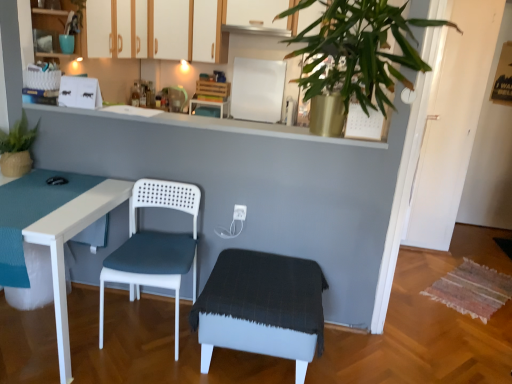
Question: Considering the relative positions of white plastic electric outlet at center and white fabric step stool at center in the image provided, is white plastic electric outlet at center to the right of white fabric step stool at center from the viewer's perspective?

Choices:
 (A) yes
 (B) no

Answer: (B)

Question: Is the position of white plastic electric outlet at center more distant than that of white fabric step stool at center?

Choices:
 (A) no
 (B) yes

Answer: (B)

Question: Is white plastic electric outlet at center at the left side of white fabric step stool at center?

Choices:
 (A) yes
 (B) no

Answer: (A)

Question: Does white plastic electric outlet at center have a lesser height compared to white fabric step stool at center?

Choices:
 (A) no
 (B) yes

Answer: (B)

Question: From the image's perspective, would you say white plastic electric outlet at center is positioned over white fabric step stool at center?

Choices:
 (A) yes
 (B) no

Answer: (A)

Question: Which is correct: white fabric step stool at center is inside teal glossy cup at upper left, or outside of it?

Choices:
 (A) inside
 (B) outside

Answer: (B)

Question: Considering the positions of point (283, 311) and point (70, 44), is point (283, 311) closer or farther from the camera than point (70, 44)?

Choices:
 (A) closer
 (B) farther

Answer: (A)

Question: In terms of size, does white fabric step stool at center appear bigger or smaller than teal glossy cup at upper left?

Choices:
 (A) big
 (B) small

Answer: (A)

Question: In the image, is white fabric step stool at center positioned in front of or behind teal glossy cup at upper left?

Choices:
 (A) front
 (B) behind

Answer: (A)

Question: Relative to matte blue cup at upper left, marked as the 3th cabinetry in a back-to-front arrangement, is white matte cabinet at upper center, the third cabinetry in the left-to-right sequence, in front or behind?

Choices:
 (A) front
 (B) behind

Answer: (B)

Question: From their relative heights in the image, would you say white matte cabinet at upper center, positioned as the 1th cabinetry in back-to-front order, is taller or shorter than matte blue cup at upper left, positioned as the first cabinetry in left-to-right order?

Choices:
 (A) short
 (B) tall

Answer: (B)

Question: Looking at the image, does white matte cabinet at upper center, the third cabinetry in the left-to-right sequence, seem bigger or smaller compared to matte blue cup at upper left, which is the third cabinetry in right-to-left order?

Choices:
 (A) small
 (B) big

Answer: (B)

Question: From a real-world perspective, is white matte cabinet at upper center, the first cabinetry in the right-to-left sequence, above or below matte blue cup at upper left, marked as the 3th cabinetry in a back-to-front arrangement?

Choices:
 (A) above
 (B) below

Answer: (A)

Question: Relative to matte blue cup at upper left, which is the third cabinetry in right-to-left order, is matte green plant at left in front or behind?

Choices:
 (A) front
 (B) behind

Answer: (A)

Question: Is matte green plant at left spatially inside matte blue cup at upper left, marked as the 3th cabinetry in a back-to-front arrangement, or outside of it?

Choices:
 (A) inside
 (B) outside

Answer: (B)